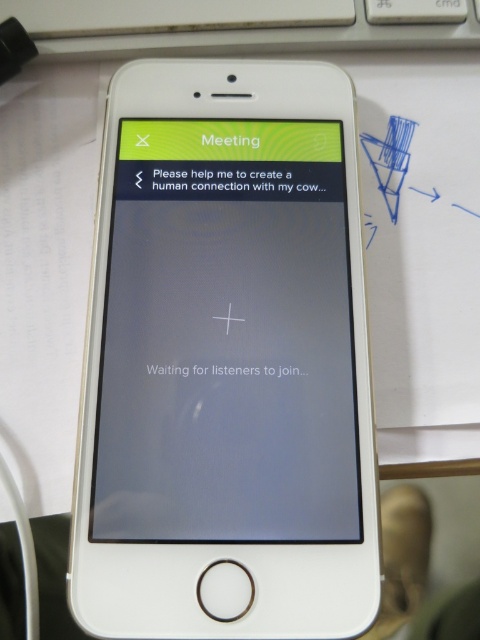
Question: Does matte glass screen at center come in front of white plastic keyboard at upper center?

Choices:
 (A) no
 (B) yes

Answer: (B)

Question: Can you confirm if matte glass screen at center is smaller than white plastic keyboard at upper center?

Choices:
 (A) no
 (B) yes

Answer: (A)

Question: Which object appears farthest from the camera in this image?

Choices:
 (A) matte glass screen at center
 (B) white plastic keyboard at upper center

Answer: (B)

Question: Considering the relative positions of matte glass screen at center and white plastic keyboard at upper center in the image provided, where is matte glass screen at center located with respect to white plastic keyboard at upper center?

Choices:
 (A) right
 (B) left

Answer: (B)